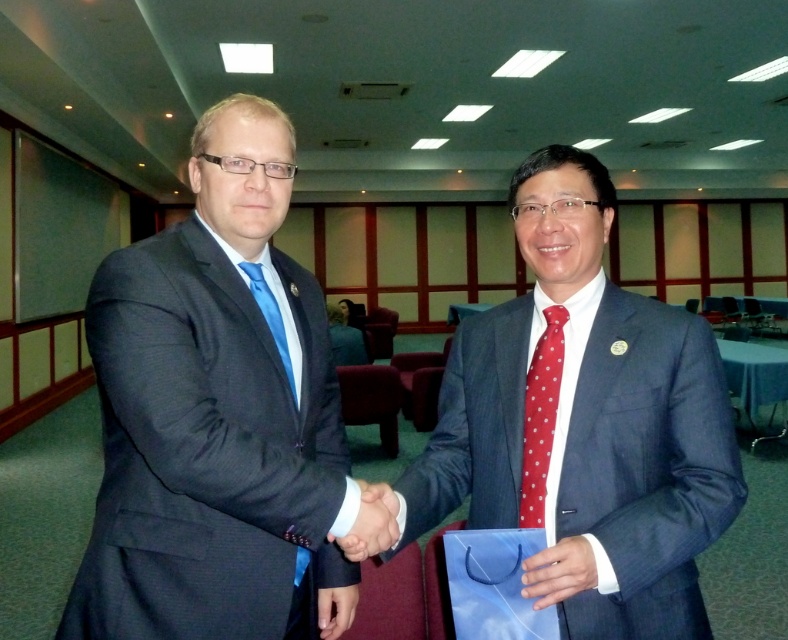
You are a photographer positioned at the entrance of the room. You need to capture a photo where both the matte blue suit at center and the matte blue tie at left are clearly visible. Given their current positions, can you frame the shot so that both are within the camera lens without moving either object?

The matte blue suit at center and matte blue tie at left are 22.75 inches apart from each other. Since the distance between them is manageable within a typical camera lens framing, yes, you can capture both in the same shot without needing to move either object.

You are a photographer standing in the room and want to take a photo of the matte black suit at left and the matte black hand at center. Which object should you focus on first to ensure it appears sharp in the photo?

The matte black suit at left is closer to the viewer than the matte black hand at center, so you should focus on the matte black suit at left first to ensure it appears sharp in the photo.